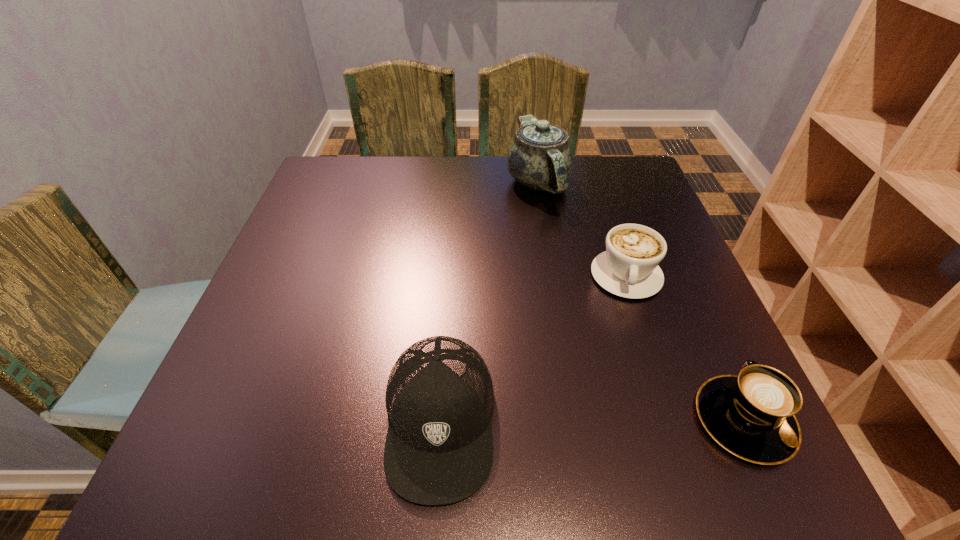
Identify the location of free region at the right edge of the desktop. The image size is (960, 540). (693, 306).

Locate an element on the screen. vacant region at the near left corner of the desktop is located at coordinates click(x=266, y=420).

Locate an element on the screen. vacant area at the far right corner is located at coordinates (636, 168).

The image size is (960, 540). I want to click on vacant space that's between the leftmost object and the farthest object, so click(489, 301).

Find the location of a particular element. Image resolution: width=960 pixels, height=540 pixels. vacant area that lies between the nearer cappuccino and the third shortest object is located at coordinates (592, 420).

Identify the location of vacant space that is in between the farthest object and the cap. This screenshot has height=540, width=960. (489, 301).

At what (x,y) coordinates should I click in order to perform the action: click on free area in between the third shortest object and the chinaware. Please return your answer as a coordinate pair (x, y). The image size is (960, 540). Looking at the image, I should click on (489, 301).

Find the location of a particular element. This screenshot has height=540, width=960. free space between the farthest object and the nearer cappuccino is located at coordinates (641, 301).

At what (x,y) coordinates should I click in order to perform the action: click on blank region between the farther cappuccino and the nearer cappuccino. Please return your answer as a coordinate pair (x, y). This screenshot has width=960, height=540. Looking at the image, I should click on (685, 348).

The image size is (960, 540). Identify the location of vacant space that is in between the farther cappuccino and the leftmost object. (533, 348).